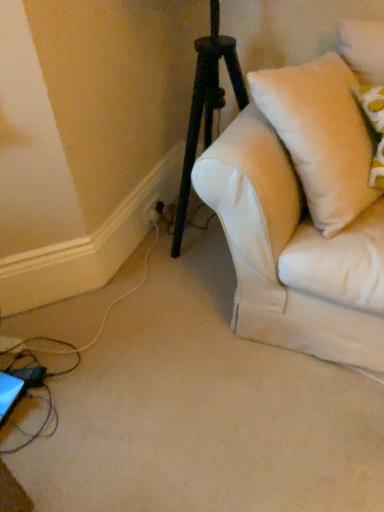
Question: From the image's perspective, is white plastic electric outlet at lower left positioned above or below white soft pillow at upper right?

Choices:
 (A) above
 (B) below

Answer: (B)

Question: In the image, is white plastic electric outlet at lower left on the left side or the right side of white soft pillow at upper right?

Choices:
 (A) right
 (B) left

Answer: (B)

Question: Looking at their shapes, would you say white plastic electric outlet at lower left is wider or thinner than white soft pillow at upper right?

Choices:
 (A) wide
 (B) thin

Answer: (B)

Question: Is white soft pillow at upper right wider or thinner than white plastic electric outlet at lower left?

Choices:
 (A) thin
 (B) wide

Answer: (B)

Question: Does point (329, 109) appear closer or farther from the camera than point (147, 208)?

Choices:
 (A) closer
 (B) farther

Answer: (A)

Question: Is white soft pillow at upper right bigger or smaller than white plastic electric outlet at lower left?

Choices:
 (A) small
 (B) big

Answer: (B)

Question: Is white soft pillow at upper right in front of or behind white plastic electric outlet at lower left in the image?

Choices:
 (A) behind
 (B) front

Answer: (B)